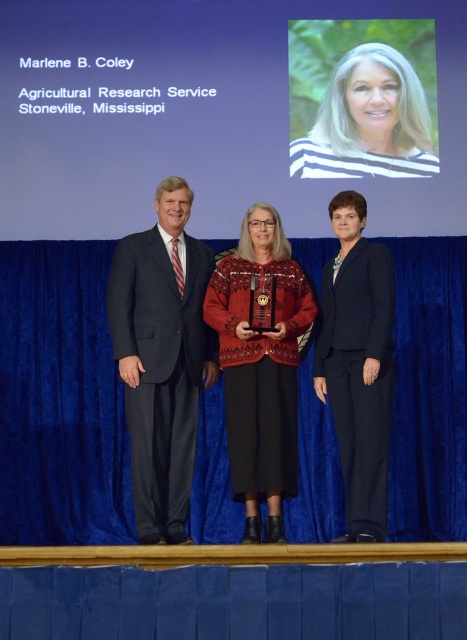
Question: Which point is farther from the camera taking this photo?

Choices:
 (A) (247, 518)
 (B) (414, 83)
 (C) (220, 525)
 (D) (365, 243)

Answer: (B)

Question: Which point is closer to the camera?

Choices:
 (A) striped shirt at upper center
 (B) black smooth suit at right

Answer: (B)

Question: Is black smooth suit at right thinner than striped shirt at upper center?

Choices:
 (A) yes
 (B) no

Answer: (A)

Question: Which point appears farthest from the camera in this image?

Choices:
 (A) click(183, 484)
 (B) click(328, 396)

Answer: (B)

Question: Is blue fabric curtain at center below black smooth suit at right?

Choices:
 (A) yes
 (B) no

Answer: (A)

Question: Is dark blue suit at center to the right of knitted sweater at center from the viewer's perspective?

Choices:
 (A) yes
 (B) no

Answer: (B)